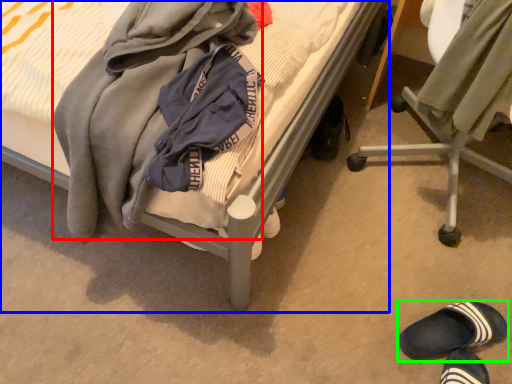
Question: Considering the real-world distances, which object is closest to clothing (highlighted by a red box)? bed (highlighted by a blue box) or footwear (highlighted by a green box).

Choices:
 (A) bed
 (B) footwear

Answer: (A)